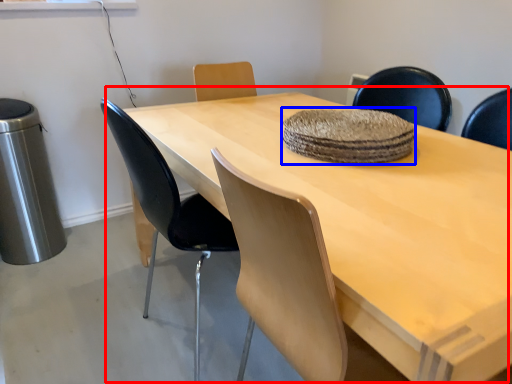
Question: Which object appears farthest to the camera in this image, table (highlighted by a red box) or mat (highlighted by a blue box)?

Choices:
 (A) table
 (B) mat

Answer: (B)